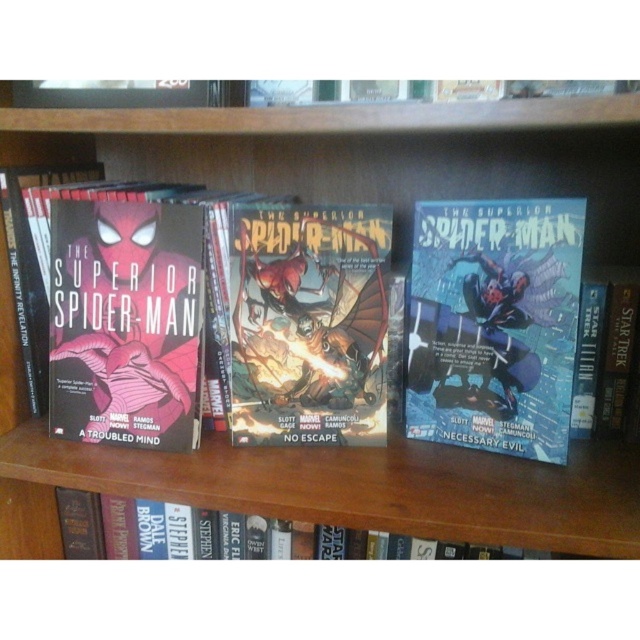
In the scene shown: Does matte black comic book at center appear on the right side of hardcover book at lower center?

Indeed, matte black comic book at center is positioned on the right side of hardcover book at lower center.

What do you see at coordinates (493, 323) in the screenshot? This screenshot has height=640, width=640. I see `matte black comic book at center` at bounding box center [493, 323].

Between point (451, 356) and point (502, 557), which one is positioned in front?

Point (451, 356)

The height and width of the screenshot is (640, 640). In order to click on matte black comic book at center in this screenshot , I will do `click(493, 323)`.

Does shiny metallic comic book at center appear on the right side of matte black comic book at left?

Correct, you'll find shiny metallic comic book at center to the right of matte black comic book at left.

Who is shorter, shiny metallic comic book at center or matte black comic book at left?

shiny metallic comic book at center

Describe the element at coordinates (307, 323) in the screenshot. This screenshot has height=640, width=640. I see `shiny metallic comic book at center` at that location.

You are a GUI agent. You are given a task and a screenshot of the screen. Output one action in this format:
    pyautogui.click(x=<x>, y=<y>)
    Task: Click on the shiny metallic comic book at center
    The image size is (640, 640).
    Given the screenshot: What is the action you would take?
    pyautogui.click(x=307, y=323)

Does matte black comic book at center have a greater width compared to matte black comic book at left?

No.

Looking at this image, who is higher up, matte black comic book at center or matte black comic book at left?

Positioned higher is matte black comic book at left.

At what (x,y) coordinates should I click in order to perform the action: click on matte black comic book at center. Please return your answer as a coordinate pair (x, y). The width and height of the screenshot is (640, 640). Looking at the image, I should click on (493, 323).